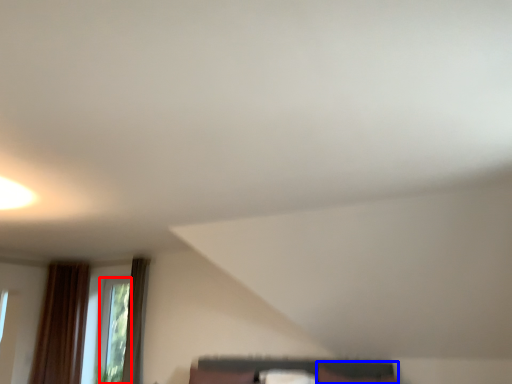
Question: Which object appears farthest to the camera in this image, window (highlighted by a red box) or furniture (highlighted by a blue box)?

Choices:
 (A) window
 (B) furniture

Answer: (A)